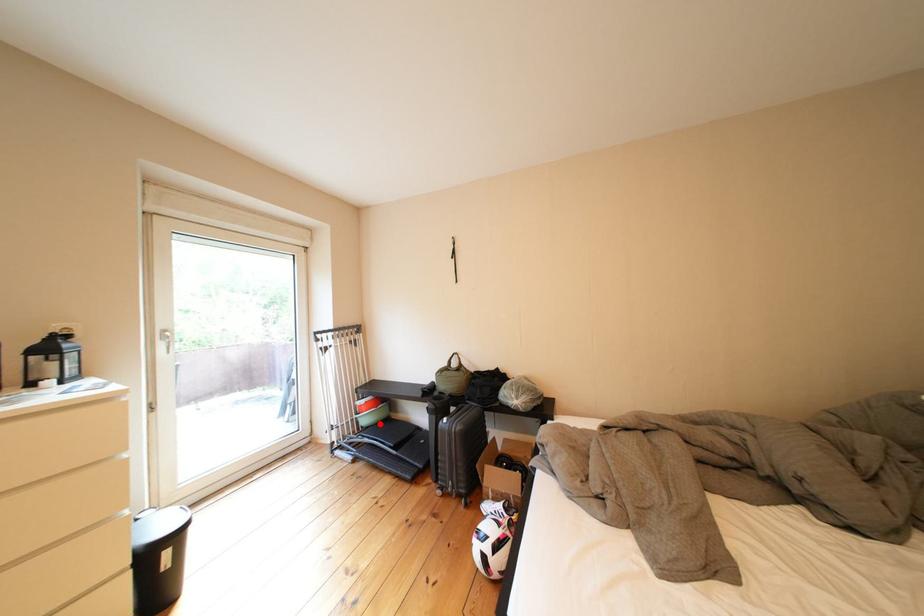
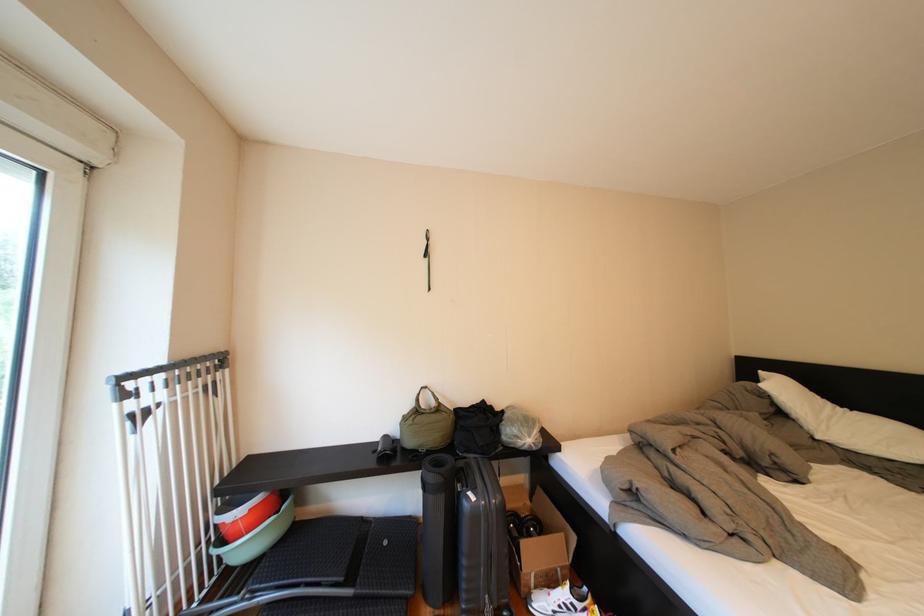
Question: I am providing you with two images of the same scene from different viewpoints. A red point is shown in image1. For the corresponding object point in image2, is it positioned nearer or farther from the camera?

Choices:
 (A) Nearer
 (B) Farther

Answer: (A)